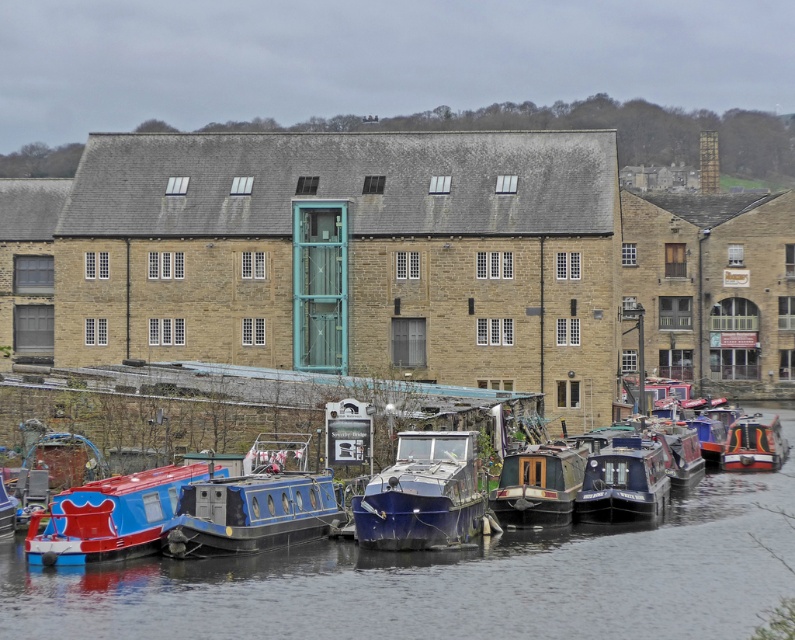
You are a photographer planning to take a photo of the blue glossy boats at lower center and the blue glossy boat at lower left. Which boat should you focus on to capture the most detailed image?

The blue glossy boats at lower center is bigger than the blue glossy boat at lower left, so focusing on the blue glossy boats at lower center will allow you to capture more detailed features in the photo.

You are a photographer planning to take a photo of the blue glossy boats at lower center and the blue polished wood boat at center. Which boat should you focus on if you want to capture the one that is taller?

The blue polished wood boat at center is taller than the blue glossy boats at lower center, so you should focus on the blue polished wood boat at center.